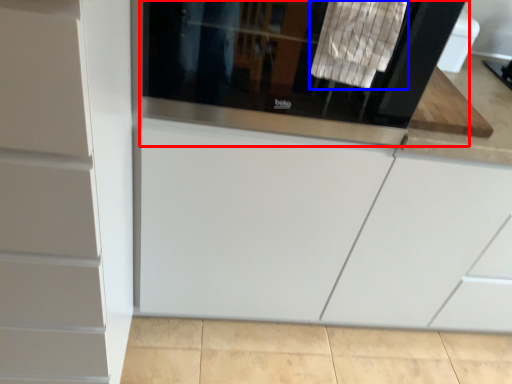
Question: Which object is closer to the camera taking this photo, screen door (highlighted by a red box) or laundry (highlighted by a blue box)?

Choices:
 (A) screen door
 (B) laundry

Answer: (B)